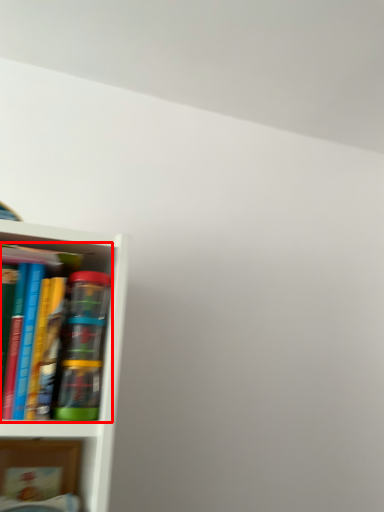
Question: From the image's perspective, where is book (annotated by the red box) located in relation to book in the image?

Choices:
 (A) below
 (B) above

Answer: (B)